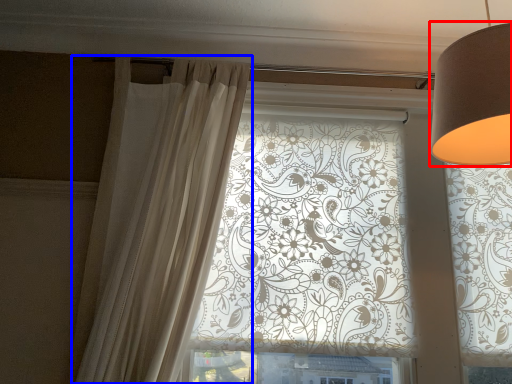
Question: Which point is further to the camera, lamp (highlighted by a red box) or curtain (highlighted by a blue box)?

Choices:
 (A) lamp
 (B) curtain

Answer: (B)